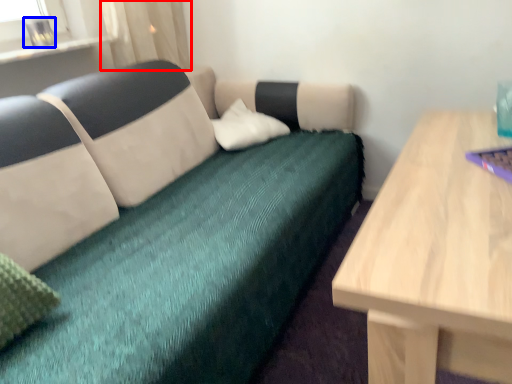
Question: Which object appears farthest to the camera in this image, curtain (highlighted by a red box) or glass vase (highlighted by a blue box)?

Choices:
 (A) curtain
 (B) glass vase

Answer: (A)